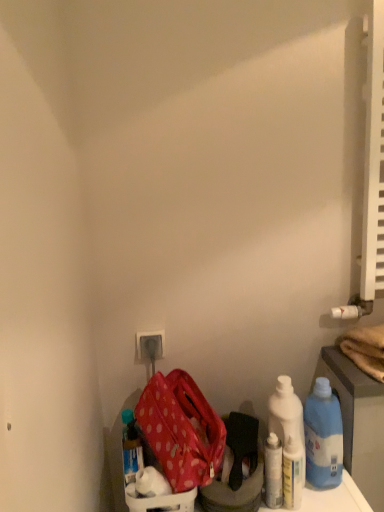
Locate an element on the screen. blue plastic bottle at lower right, which ranks as the 4th bottle in left-to-right order is located at coordinates (323, 436).

Image resolution: width=384 pixels, height=512 pixels. What do you see at coordinates (292, 473) in the screenshot?
I see `white glossy bottle at lower right, acting as the second bottle starting from the right` at bounding box center [292, 473].

What do you see at coordinates (273, 472) in the screenshot? The width and height of the screenshot is (384, 512). I see `white glossy bottle at lower right, arranged as the 2th bottle when viewed from the left` at bounding box center [273, 472].

This screenshot has height=512, width=384. I want to click on white glossy bottle at lower right, arranged as the 2th bottle when viewed from the left, so coord(273,472).

Identify the location of white plastic bottles at center right. (286, 414).

You are a GUI agent. You are given a task and a screenshot of the screen. Output one action in this format:
    pyautogui.click(x=<x>, y=<y>)
    Task: Click on the blue plastic bottle at lower right, acting as the first bottle starting from the right
    
    Given the screenshot: What is the action you would take?
    pyautogui.click(x=323, y=436)

Between white plastic bottles at center right and polka dot fabric bag at lower left, which one appears on the right side from the viewer's perspective?

white plastic bottles at center right.

Which object is wider, white plastic bottles at center right or polka dot fabric bag at lower left?

polka dot fabric bag at lower left is wider.

Measure the distance between white plastic bottles at center right and polka dot fabric bag at lower left.

white plastic bottles at center right and polka dot fabric bag at lower left are 23.16 centimeters apart.

Is white plastic bottles at center right placed right next to polka dot fabric bag at lower left?

No, white plastic bottles at center right is not next to polka dot fabric bag at lower left.

In the image, is white plastic electric outlet at lower center positioned in front of or behind white glossy bottle at lower right, acting as the second bottle starting from the right?

In the image, white plastic electric outlet at lower center appears behind white glossy bottle at lower right, acting as the second bottle starting from the right.

From the image's perspective, would you say white plastic electric outlet at lower center is shown under white glossy bottle at lower right, acting as the second bottle starting from the right?

No, from the image's perspective, white plastic electric outlet at lower center is not below white glossy bottle at lower right, acting as the second bottle starting from the right.

Looking at this image, can we say white plastic electric outlet at lower center lies outside white glossy bottle at lower right, acting as the second bottle starting from the right?

Indeed, white plastic electric outlet at lower center is completely outside white glossy bottle at lower right, acting as the second bottle starting from the right.

What's the angular difference between white plastic electric outlet at lower center and white glossy bottle at lower right, acting as the second bottle starting from the right,'s facing directions?

There is a 0.00136-degree angle between the facing directions of white plastic electric outlet at lower center and white glossy bottle at lower right, acting as the second bottle starting from the right.

In terms of height, does white plastic bottles at center right look taller or shorter compared to blue plastic bottle at lower right, acting as the first bottle starting from the right?

Clearly, white plastic bottles at center right is taller compared to blue plastic bottle at lower right, acting as the first bottle starting from the right.

Considering the positions of objects white plastic bottles at center right and blue plastic bottle at lower right, acting as the first bottle starting from the right, in the image provided, who is more to the left, white plastic bottles at center right or blue plastic bottle at lower right, acting as the first bottle starting from the right,?

white plastic bottles at center right.

Based on the photo, considering the relative positions of white plastic bottles at center right and blue plastic bottle at lower right, acting as the first bottle starting from the right, in the image provided, is white plastic bottles at center right behind blue plastic bottle at lower right, acting as the first bottle starting from the right,?

That is True.

Where is `cleaning product below the blue plastic bottle at lower right, which ranks as the 4th bottle in left-to-right order (from the image's perspective)`? This screenshot has height=512, width=384. cleaning product below the blue plastic bottle at lower right, which ranks as the 4th bottle in left-to-right order (from the image's perspective) is located at coordinates (286, 414).

Is blue plastic bottle at lower left, marked as the first bottle in a left-to-right arrangement, next to polka dot fabric bag at lower left?

No, blue plastic bottle at lower left, marked as the first bottle in a left-to-right arrangement, is not touching polka dot fabric bag at lower left.

From a real-world perspective, which object rests below the other?

From a 3D spatial view, blue plastic bottle at lower left, the fourth bottle viewed from the right, is below.

How many degrees apart are the facing directions of blue plastic bottle at lower left, the fourth bottle viewed from the right, and polka dot fabric bag at lower left?

64.6 degrees.

Does blue plastic bottle at lower left, the fourth bottle viewed from the right, turn towards polka dot fabric bag at lower left?

No, blue plastic bottle at lower left, the fourth bottle viewed from the right, is not aimed at polka dot fabric bag at lower left.

Could you tell me if polka dot fabric bag at lower left is turned towards blue plastic bottle at lower right, which ranks as the 4th bottle in left-to-right order?

No, polka dot fabric bag at lower left is not facing towards blue plastic bottle at lower right, which ranks as the 4th bottle in left-to-right order.

Based on the photo, which object is positioned more to the left, polka dot fabric bag at lower left or blue plastic bottle at lower right, which ranks as the 4th bottle in left-to-right order?

Positioned to the left is polka dot fabric bag at lower left.

Looking at this image, can you confirm if polka dot fabric bag at lower left is wider than blue plastic bottle at lower right, acting as the first bottle starting from the right?

Yes.

Considering the relative positions of white plastic bottles at center right and white plastic electric outlet at lower center in the image provided, is white plastic bottles at center right to the left of white plastic electric outlet at lower center from the viewer's perspective?

No, white plastic bottles at center right is not to the left of white plastic electric outlet at lower center.

Can you confirm if white plastic bottles at center right is wider than white plastic electric outlet at lower center?

Yes, white plastic bottles at center right is wider than white plastic electric outlet at lower center.

Is white plastic electric outlet at lower center at the back of white plastic bottles at center right?

white plastic bottles at center right does not have its back to white plastic electric outlet at lower center.

Is point (292, 493) positioned before point (148, 357)?

Yes, point (292, 493) is closer to viewer.

Would you say white plastic electric outlet at lower center is part of white glossy bottle at lower right, acting as the second bottle starting from the right,'s contents?

No, white glossy bottle at lower right, acting as the second bottle starting from the right, does not contain white plastic electric outlet at lower center.

Would you consider white glossy bottle at lower right, acting as the second bottle starting from the right, to be distant from white plastic electric outlet at lower center?

They are positioned close to each other.

The image size is (384, 512). What are the coordinates of `bottle that is the 3rd one when counting forward from the white plastic electric outlet at lower center` in the screenshot? It's located at (292, 473).

This screenshot has width=384, height=512. Find the location of `kit in front of the white plastic bottles at center right`. kit in front of the white plastic bottles at center right is located at coordinates (181, 430).

From a real-world perspective, starting from the white plastic electric outlet at lower center, which bottle is the 4th one below it? Please provide its 2D coordinates.

[(292, 473)]

Estimate the real-world distances between objects in this image. Which object is closer to white plastic bottles at center right, white glossy bottle at lower right, marked as the third bottle in a right-to-left arrangement, or blue plastic bottle at lower left, marked as the first bottle in a left-to-right arrangement?

The object closer to white plastic bottles at center right is white glossy bottle at lower right, marked as the third bottle in a right-to-left arrangement.

Considering their positions, is blue plastic bottle at lower right, which ranks as the 4th bottle in left-to-right order, positioned further to white glossy bottle at lower right, marked as the third bottle in a right-to-left arrangement, than white plastic electric outlet at lower center?

white plastic electric outlet at lower center is further to white glossy bottle at lower right, marked as the third bottle in a right-to-left arrangement.

Consider the image. Based on their spatial positions, is white plastic electric outlet at lower center or blue plastic bottle at lower left, the fourth bottle viewed from the right, closer to white glossy bottle at lower right, acting as the second bottle starting from the right?

blue plastic bottle at lower left, the fourth bottle viewed from the right, is positioned closer to the anchor white glossy bottle at lower right, acting as the second bottle starting from the right.

Estimate the real-world distances between objects in this image. Which object is closer to white glossy bottle at lower right, arranged as the 2th bottle when viewed from the left, blue plastic bottle at lower right, acting as the first bottle starting from the right, or polka dot fabric bag at lower left?

The object closer to white glossy bottle at lower right, arranged as the 2th bottle when viewed from the left, is blue plastic bottle at lower right, acting as the first bottle starting from the right.

When comparing their distances from white plastic electric outlet at lower center, does blue plastic bottle at lower right, which ranks as the 4th bottle in left-to-right order, or blue plastic bottle at lower left, marked as the first bottle in a left-to-right arrangement, seem further?

blue plastic bottle at lower right, which ranks as the 4th bottle in left-to-right order.

Looking at the image, which one is located closer to white plastic bottles at center right, white glossy bottle at lower right, acting as the second bottle starting from the right, or blue plastic bottle at lower left, the fourth bottle viewed from the right?

Based on the image, white glossy bottle at lower right, acting as the second bottle starting from the right, appears to be nearer to white plastic bottles at center right.

Looking at the image, which one is located closer to white glossy bottle at lower right, arranged as the 2th bottle when viewed from the left, polka dot fabric bag at lower left or white plastic bottles at center right?

white plastic bottles at center right.

From the image, which object appears to be nearer to blue plastic bottle at lower right, which ranks as the 4th bottle in left-to-right order, white plastic bottles at center right or white glossy bottle at lower right, acting as the second bottle starting from the right?

Among the two, white plastic bottles at center right is located nearer to blue plastic bottle at lower right, which ranks as the 4th bottle in left-to-right order.

Locate an element on the screen. The image size is (384, 512). cleaning product between white glossy bottle at lower right, placed as the third bottle when sorted from left to right, and blue plastic bottle at lower right, acting as the first bottle starting from the right, in the horizontal direction is located at coordinates (286, 414).

At what (x,y) coordinates should I click in order to perform the action: click on kit between blue plastic bottle at lower left, the fourth bottle viewed from the right, and white plastic bottles at center right, in the horizontal direction. Please return your answer as a coordinate pair (x, y). Image resolution: width=384 pixels, height=512 pixels. Looking at the image, I should click on (181, 430).

Where is `cleaning product between white plastic electric outlet at lower center and blue plastic bottle at lower right, which ranks as the 4th bottle in left-to-right order`? This screenshot has height=512, width=384. cleaning product between white plastic electric outlet at lower center and blue plastic bottle at lower right, which ranks as the 4th bottle in left-to-right order is located at coordinates (286, 414).

Identify the location of cleaning product positioned between polka dot fabric bag at lower left and white plastic electric outlet at lower center from near to far. (286, 414).